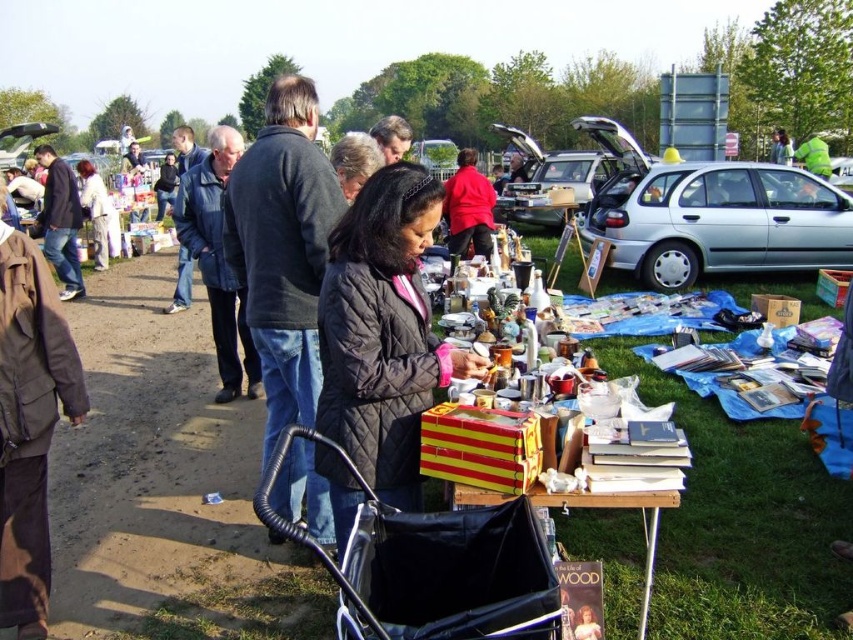
Question: Which point is farther to the camera?

Choices:
 (A) silver metallic hatchback at center-right
 (B) black quilted fabric baby carriage at lower center
 (C) white cotton jacket at center

Answer: (C)

Question: Which point is closer to the camera?

Choices:
 (A) black quilted fabric baby carriage at lower center
 (B) white cotton jacket at center
 (C) black quilted jacket at center
 (D) silver metallic hatchback at center-right

Answer: (A)

Question: Is black quilted fabric baby carriage at lower center smaller than silver metallic hatchback at center-right?

Choices:
 (A) yes
 (B) no

Answer: (A)

Question: From the image, what is the correct spatial relationship of black quilted jacket at center in relation to black quilted fabric baby carriage at lower center?

Choices:
 (A) left
 (B) right

Answer: (A)

Question: Can you confirm if black quilted jacket at center is wider than black quilted fabric baby carriage at lower center?

Choices:
 (A) no
 (B) yes

Answer: (A)

Question: Which object is the farthest from the black quilted jacket at center?

Choices:
 (A) white cotton jacket at center
 (B) silver metallic hatchback at center-right

Answer: (A)